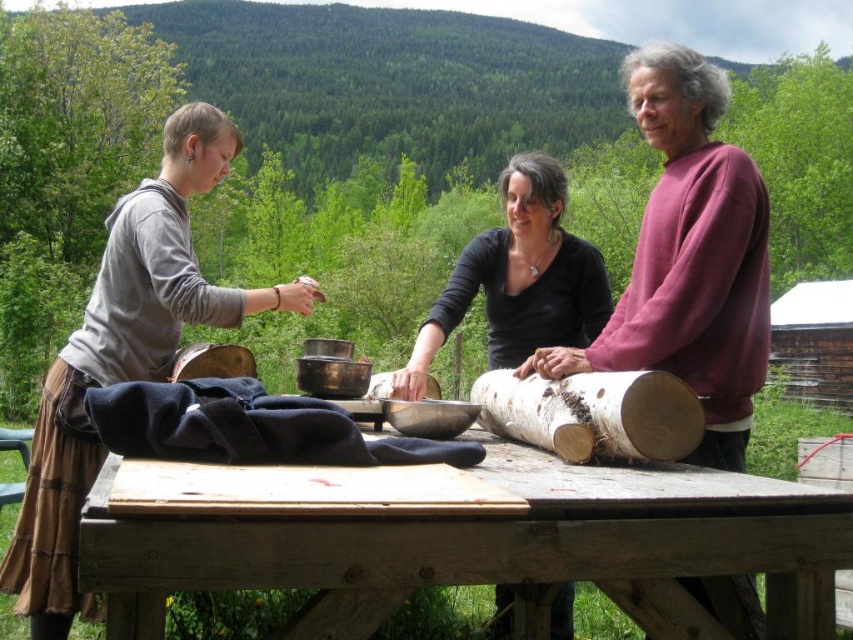
What do you see at coordinates (494, 547) in the screenshot? I see `wooden at center` at bounding box center [494, 547].

What are the coordinates of `wooden at center` in the screenshot? It's located at (494, 547).

Does black matte shirt at center have a larger size compared to bark wood log at center?

No.

Is black matte shirt at center closer to camera compared to bark wood log at center?

No, black matte shirt at center is behind bark wood log at center.

Is point (505, 253) closer to camera compared to point (685, 436)?

That is False.

This screenshot has height=640, width=853. Identify the location of black matte shirt at center. (518, 280).

Who is positioned more to the left, wooden at center or black matte shirt at center?

wooden at center is more to the left.

Can you confirm if wooden at center is wider than black matte shirt at center?

Yes, wooden at center is wider than black matte shirt at center.

Between point (132, 618) and point (498, 330), which one is positioned in front?

Point (132, 618) is more forward.

This screenshot has height=640, width=853. Identify the location of wooden at center. (494, 547).